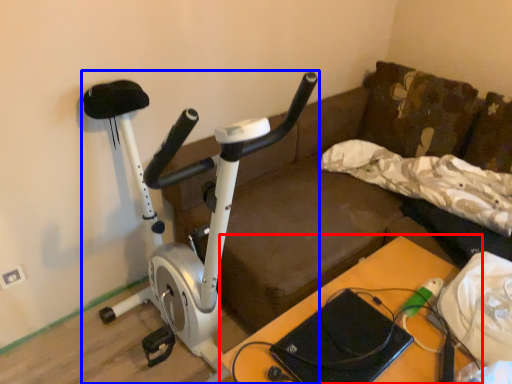
Question: Which point is further to the camera, table (highlighted by a red box) or stationary bicycle (highlighted by a blue box)?

Choices:
 (A) table
 (B) stationary bicycle

Answer: (A)